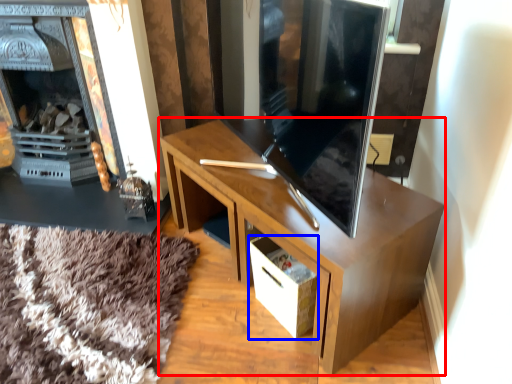
Question: Which point is further to the camera, desk (highlighted by a red box) or drawer (highlighted by a blue box)?

Choices:
 (A) desk
 (B) drawer

Answer: (B)